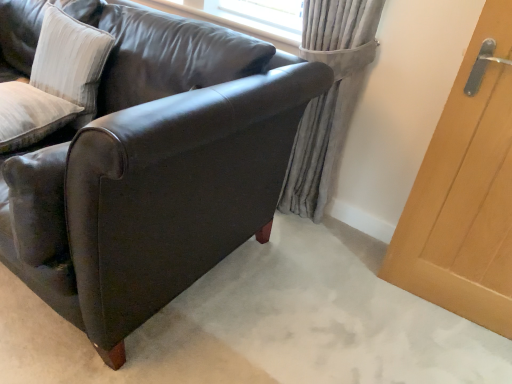
Question: From the image's perspective, is white textured pillow at upper left, the 2th pillow viewed from the top, positioned above or below light brown wood door at right?

Choices:
 (A) above
 (B) below

Answer: (A)

Question: Would you say white textured pillow at upper left, which ranks as the 1th pillow in bottom-to-top order, is inside or outside light brown wood door at right?

Choices:
 (A) outside
 (B) inside

Answer: (A)

Question: Based on their relative distances, which object is nearer to the matte black leather couch at center?

Choices:
 (A) white textured pillow at upper left, the 2th pillow viewed from the top
 (B) gray fabric curtain at upper right
 (C) light brown wood door at right
 (D) white textured cushion at upper left, the 2th pillow in the bottom-to-top sequence

Answer: (D)

Question: Considering the real-world distances, which object is closest to the white textured pillow at upper left, which ranks as the 1th pillow in bottom-to-top order?

Choices:
 (A) white textured cushion at upper left, the 1th pillow from the top
 (B) light brown wood door at right
 (C) gray fabric curtain at upper right
 (D) matte black leather couch at center

Answer: (A)